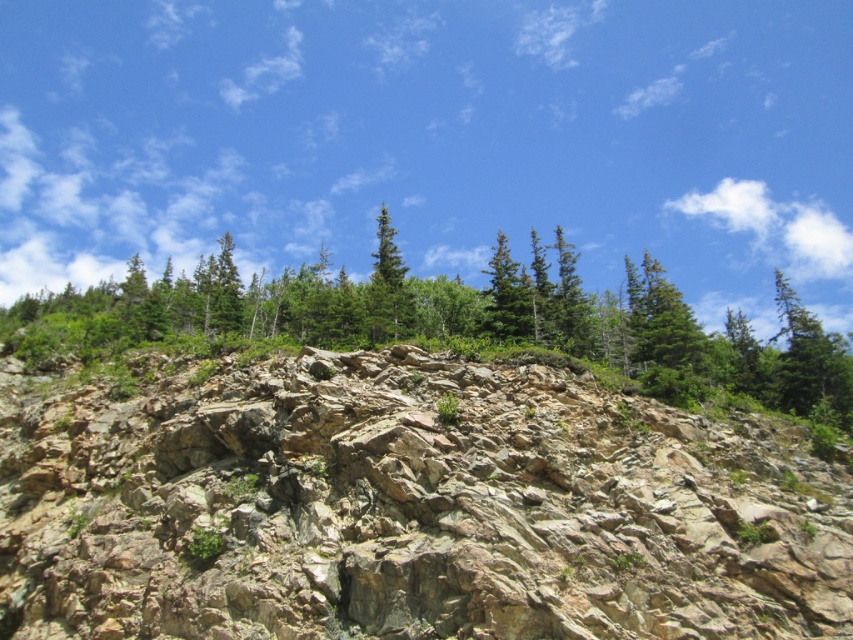
Does rocky terrain at center have a lesser height compared to green matte tree at center?

Indeed, rocky terrain at center has a lesser height compared to green matte tree at center.

What do you see at coordinates (405, 508) in the screenshot? I see `rocky terrain at center` at bounding box center [405, 508].

The width and height of the screenshot is (853, 640). I want to click on rocky terrain at center, so click(405, 508).

Between green textured trees at upper center and green matte tree at center, which one is positioned higher?

green matte tree at center

Is point (97, 328) farther from camera compared to point (381, 273)?

No, (97, 328) is in front of (381, 273).

I want to click on green textured trees at upper center, so click(x=643, y=333).

Is rocky terrain at center to the left of green textured trees at upper center from the viewer's perspective?

Yes, rocky terrain at center is to the left of green textured trees at upper center.

Consider the image. Which is below, rocky terrain at center or green textured trees at upper center?

rocky terrain at center is lower down.

The height and width of the screenshot is (640, 853). Identify the location of rocky terrain at center. (405, 508).